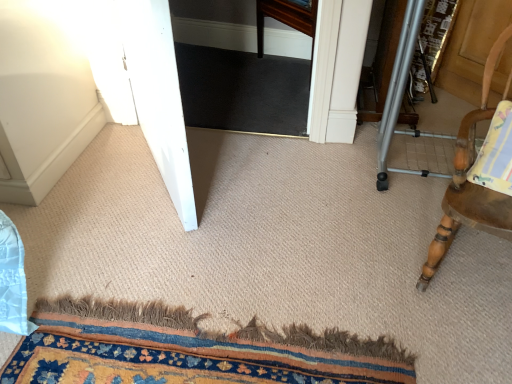
Question: Is carpeted mat at lower center facing away from white glossy screen door at left?

Choices:
 (A) no
 (B) yes

Answer: (A)

Question: Does carpeted mat at lower center have a greater height compared to white glossy screen door at left?

Choices:
 (A) no
 (B) yes

Answer: (A)

Question: Is carpeted mat at lower center not within white glossy screen door at left?

Choices:
 (A) no
 (B) yes

Answer: (B)

Question: Is carpeted mat at lower center closer to the viewer compared to white glossy screen door at left?

Choices:
 (A) yes
 (B) no

Answer: (A)

Question: Does carpeted mat at lower center have a lesser height compared to white glossy screen door at left?

Choices:
 (A) yes
 (B) no

Answer: (A)

Question: From a real-world perspective, is carpeted mat at lower center located higher than white glossy screen door at left?

Choices:
 (A) yes
 (B) no

Answer: (B)

Question: Can we say wooden chair with striped cushion at right lies outside carpeted mat at lower center?

Choices:
 (A) yes
 (B) no

Answer: (A)

Question: Considering the relative sizes of wooden chair with striped cushion at right and carpeted mat at lower center in the image provided, is wooden chair with striped cushion at right thinner than carpeted mat at lower center?

Choices:
 (A) no
 (B) yes

Answer: (B)

Question: Can you confirm if wooden chair with striped cushion at right is shorter than carpeted mat at lower center?

Choices:
 (A) yes
 (B) no

Answer: (B)

Question: From the image's perspective, is wooden chair with striped cushion at right on top of carpeted mat at lower center?

Choices:
 (A) no
 (B) yes

Answer: (B)

Question: Is the surface of wooden chair with striped cushion at right in direct contact with carpeted mat at lower center?

Choices:
 (A) yes
 (B) no

Answer: (B)

Question: Is wooden chair with striped cushion at right further to camera compared to carpeted mat at lower center?

Choices:
 (A) yes
 (B) no

Answer: (B)

Question: Does white glossy screen door at left have a lesser width compared to wooden chair with striped cushion at right?

Choices:
 (A) no
 (B) yes

Answer: (B)